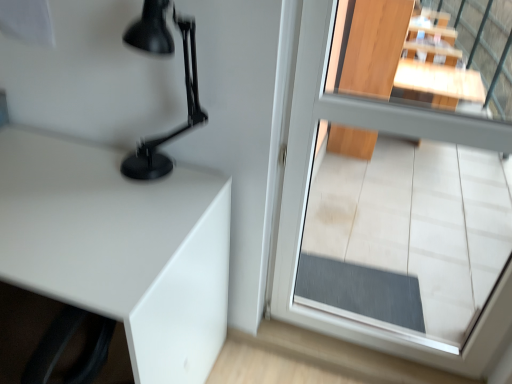
You are a GUI agent. You are given a task and a screenshot of the screen. Output one action in this format:
    pyautogui.click(x=<x>, y=<y>)
    Task: Click on the transparent glass door at center
    Image resolution: width=512 pixels, height=384 pixels.
    Given the screenshot: What is the action you would take?
    pyautogui.click(x=307, y=194)

Measure the distance between matte black lamp at upper left and camera.

The distance of matte black lamp at upper left from camera is 93.85 centimeters.

What do you see at coordinates (176, 129) in the screenshot? I see `matte black lamp at upper left` at bounding box center [176, 129].

Find the location of a particular element. The height and width of the screenshot is (384, 512). white glossy table at left is located at coordinates (120, 247).

In the scene shown: Considering the relative positions of transparent glass door at center and white glossy table at left in the image provided, is transparent glass door at center to the right of white glossy table at left from the viewer's perspective?

Correct, you'll find transparent glass door at center to the right of white glossy table at left.

Between transparent glass door at center and white glossy table at left, which one has more height?

transparent glass door at center is taller.

Is transparent glass door at center next to white glossy table at left?

transparent glass door at center and white glossy table at left are not in contact.

Considering the sizes of matte black lamp at upper left and transparent glass door at center in the image, is matte black lamp at upper left taller or shorter than transparent glass door at center?

matte black lamp at upper left is shorter than transparent glass door at center.

Would you say matte black lamp at upper left is outside transparent glass door at center?

Absolutely, matte black lamp at upper left is external to transparent glass door at center.

Does matte black lamp at upper left appear on the right side of transparent glass door at center?

No, matte black lamp at upper left is not to the right of transparent glass door at center.

Is matte black lamp at upper left not near transparent glass door at center?

No, matte black lamp at upper left is not far from transparent glass door at center.

Could you tell me if white glossy table at left is turned towards transparent glass door at center?

No, white glossy table at left is not oriented towards transparent glass door at center.

Is white glossy table at left thinner than transparent glass door at center?

In fact, white glossy table at left might be wider than transparent glass door at center.

Considering the positions of objects white glossy table at left and transparent glass door at center in the image provided, who is more to the right, white glossy table at left or transparent glass door at center?

Positioned to the right is transparent glass door at center.

From a real-world perspective, is white glossy table at left positioned above or below transparent glass door at center?

In terms of real-world spatial position, white glossy table at left is below transparent glass door at center.

Considering the relative positions of matte black lamp at upper left and white glossy table at left in the image provided, is matte black lamp at upper left to the right of white glossy table at left from the viewer's perspective?

Yes.

From a real-world perspective, who is located lower, matte black lamp at upper left or white glossy table at left?

white glossy table at left.

Who is taller, matte black lamp at upper left or white glossy table at left?

white glossy table at left.

Is matte black lamp at upper left turned away from white glossy table at left?

That's not correct — matte black lamp at upper left is not looking away from white glossy table at left.

Consider the image. From a real-world perspective, is white glossy table at left positioned above or below matte black lamp at upper left?

white glossy table at left is situated lower than matte black lamp at upper left in the real world.

Does point (76, 220) come in front of point (161, 33)?

No, (76, 220) is further to viewer.

Is white glossy table at left inside the boundaries of matte black lamp at upper left, or outside?

white glossy table at left is spatially situated outside matte black lamp at upper left.

Does white glossy table at left appear on the right side of matte black lamp at upper left?

No.

Which object is further away from the camera taking this photo, transparent glass door at center or matte black lamp at upper left?

matte black lamp at upper left.

Looking at the image, does transparent glass door at center seem bigger or smaller compared to matte black lamp at upper left?

Considering their sizes, transparent glass door at center takes up more space than matte black lamp at upper left.

Which object is positioned more to the left, transparent glass door at center or matte black lamp at upper left?

matte black lamp at upper left is more to the left.

From the image's perspective, would you say transparent glass door at center is shown under matte black lamp at upper left?

Yes.

At what (x,y) coordinates should I click in order to perform the action: click on glass door lying on the right of white glossy table at left. Please return your answer as a coordinate pair (x, y). Looking at the image, I should click on (307, 194).

Locate an element on the screen. table lamp lying behind the transparent glass door at center is located at coordinates (176, 129).

From the image, which object appears to be farther from white glossy table at left, transparent glass door at center or matte black lamp at upper left?

Among the two, transparent glass door at center is located further to white glossy table at left.

Considering their positions, is matte black lamp at upper left positioned closer to transparent glass door at center than white glossy table at left?

matte black lamp at upper left.

Estimate the real-world distances between objects in this image. Which object is closer to matte black lamp at upper left, white glossy table at left or transparent glass door at center?

white glossy table at left lies closer to matte black lamp at upper left than the other object.

In the scene shown: From the image, which object appears to be farther from transparent glass door at center, white glossy table at left or matte black lamp at upper left?

white glossy table at left.

Based on their spatial positions, is matte black lamp at upper left or transparent glass door at center closer to white glossy table at left?

matte black lamp at upper left is closer to white glossy table at left.

Considering their positions, is transparent glass door at center positioned further to matte black lamp at upper left than white glossy table at left?

The object further to matte black lamp at upper left is transparent glass door at center.

Where is `table lamp situated between white glossy table at left and transparent glass door at center from left to right`? table lamp situated between white glossy table at left and transparent glass door at center from left to right is located at coordinates (176, 129).